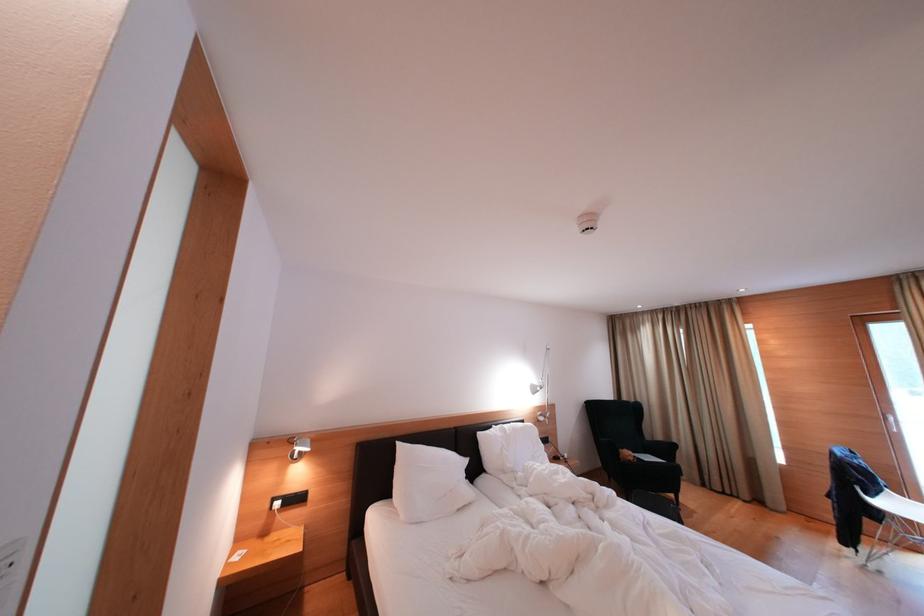
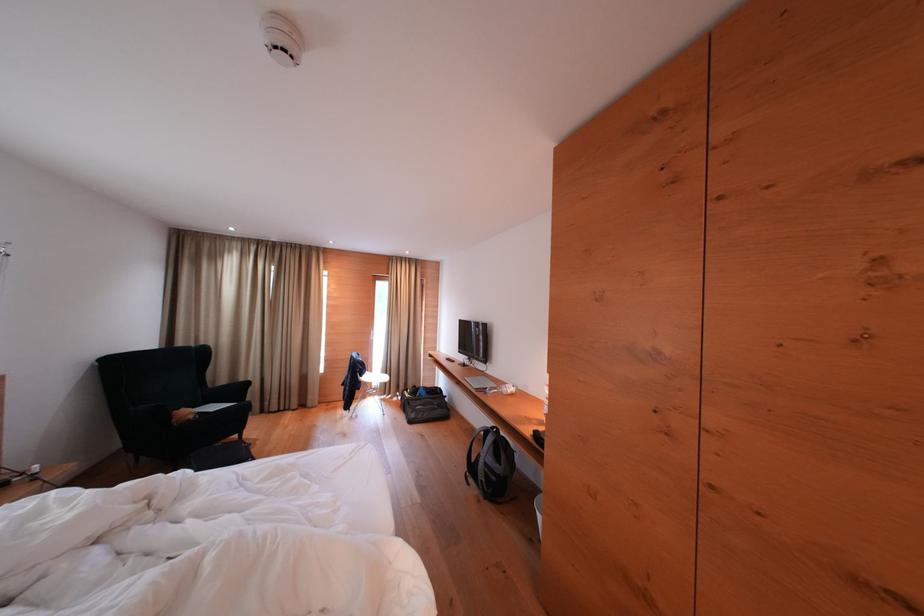
Question: The camera is either moving clockwise (left) or counter-clockwise (right) around the object. The first image is from the beginning of the video and the second image is from the end. Is the camera moving left or right when shooting the video?

Choices:
 (A) Left
 (B) Right

Answer: (A)